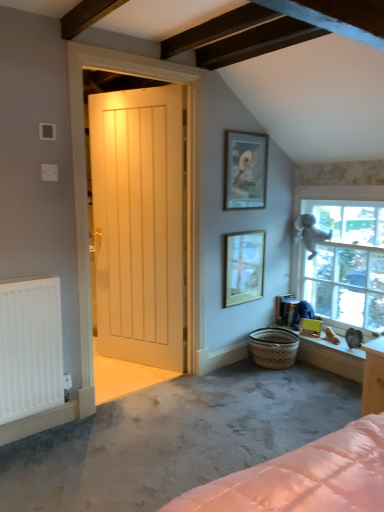
Question: Should I look upward or downward to see smooth white window sill at lower right?

Choices:
 (A) up
 (B) down

Answer: (B)

Question: From the image's perspective, is green matte picture frame at lower right, which ranks as the 3th picture frame in left-to-right order, beneath matte glass picture frame at center, which is the 2th picture frame from right to left?

Choices:
 (A) no
 (B) yes

Answer: (B)

Question: Is green matte picture frame at lower right, which ranks as the first picture frame in right-to-left order, smaller than matte glass picture frame at center, which ranks as the second picture frame in bottom-to-top order?

Choices:
 (A) yes
 (B) no

Answer: (A)

Question: Does green matte picture frame at lower right, which ranks as the 3th picture frame in left-to-right order, have a greater width compared to matte glass picture frame at center, which is the 2th picture frame from right to left?

Choices:
 (A) no
 (B) yes

Answer: (B)

Question: Is green matte picture frame at lower right, which is the 1th picture frame in bottom-to-top order, positioned before matte glass picture frame at center, acting as the second picture frame starting from the top?

Choices:
 (A) yes
 (B) no

Answer: (B)

Question: From a real-world perspective, does green matte picture frame at lower right, which ranks as the 3th picture frame in left-to-right order, stand above matte glass picture frame at center, which is the 2th picture frame from right to left?

Choices:
 (A) yes
 (B) no

Answer: (B)

Question: Is green matte picture frame at lower right, the third picture frame in the top-to-bottom sequence, at the right side of matte glass picture frame at center, which ranks as the second picture frame in bottom-to-top order?

Choices:
 (A) no
 (B) yes

Answer: (B)

Question: Is white wooden door at center oriented away from green matte picture frame at lower right, which ranks as the first picture frame in right-to-left order?

Choices:
 (A) no
 (B) yes

Answer: (A)

Question: Is white wooden door at center shorter than green matte picture frame at lower right, the third picture frame in the top-to-bottom sequence?

Choices:
 (A) yes
 (B) no

Answer: (B)

Question: From a real-world perspective, is white wooden door at center physically above green matte picture frame at lower right, which is the 1th picture frame in bottom-to-top order?

Choices:
 (A) no
 (B) yes

Answer: (B)

Question: Is white wooden door at center behind green matte picture frame at lower right, which ranks as the 3th picture frame in left-to-right order?

Choices:
 (A) no
 (B) yes

Answer: (A)

Question: Does white wooden door at center have a smaller size compared to green matte picture frame at lower right, which ranks as the 3th picture frame in left-to-right order?

Choices:
 (A) yes
 (B) no

Answer: (B)

Question: Can you confirm if white wooden door at center is wider than green matte picture frame at lower right, the third picture frame in the top-to-bottom sequence?

Choices:
 (A) yes
 (B) no

Answer: (A)

Question: Is smooth white window sill at lower right inside matte glass picture frame at center, which ranks as the second picture frame in bottom-to-top order?

Choices:
 (A) no
 (B) yes

Answer: (A)